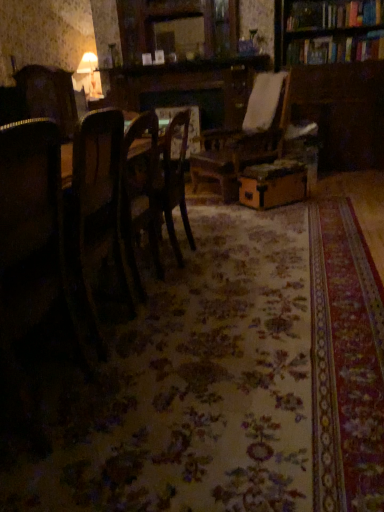
Question: Looking at the image, does dark wood chair at left, which is the second chair in front-to-back order, seem bigger or smaller compared to brown cardboard box at center?

Choices:
 (A) small
 (B) big

Answer: (A)

Question: From the image's perspective, is dark wood chair at left, which is the second chair in front-to-back order, located above or below brown cardboard box at center?

Choices:
 (A) below
 (B) above

Answer: (B)

Question: Estimate the real-world distances between objects in this image. Which object is farther from the wooden chair at center, arranged as the 3th chair when viewed from the front?

Choices:
 (A) dark wood chair at left, the second chair in the back-to-front sequence
 (B) wooden chair at left, which is the 3th chair from back to front
 (C) brown cardboard box at center
 (D) wooden table at center
 (E) wooden bookcase at upper right

Answer: (E)

Question: Which object is the closest to the dark wood chair at left, which is the second chair in front-to-back order?

Choices:
 (A) wooden table at center
 (B) brown cardboard box at center
 (C) wooden chair at center, positioned as the first chair in back-to-front order
 (D) matte white lampshade at upper left
 (E) wooden bookcase at upper right

Answer: (A)